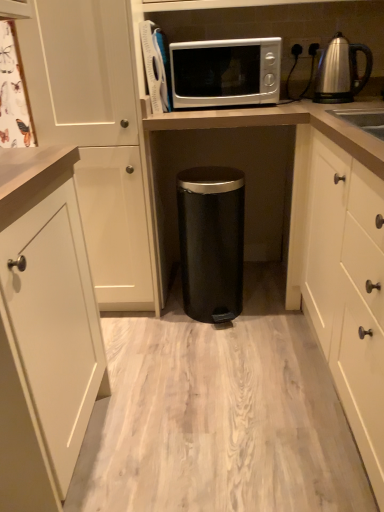
Where is `free space to the right of black matte trash can at center, acting as the second appliance starting from the left`? Image resolution: width=384 pixels, height=512 pixels. free space to the right of black matte trash can at center, acting as the second appliance starting from the left is located at coordinates (276, 305).